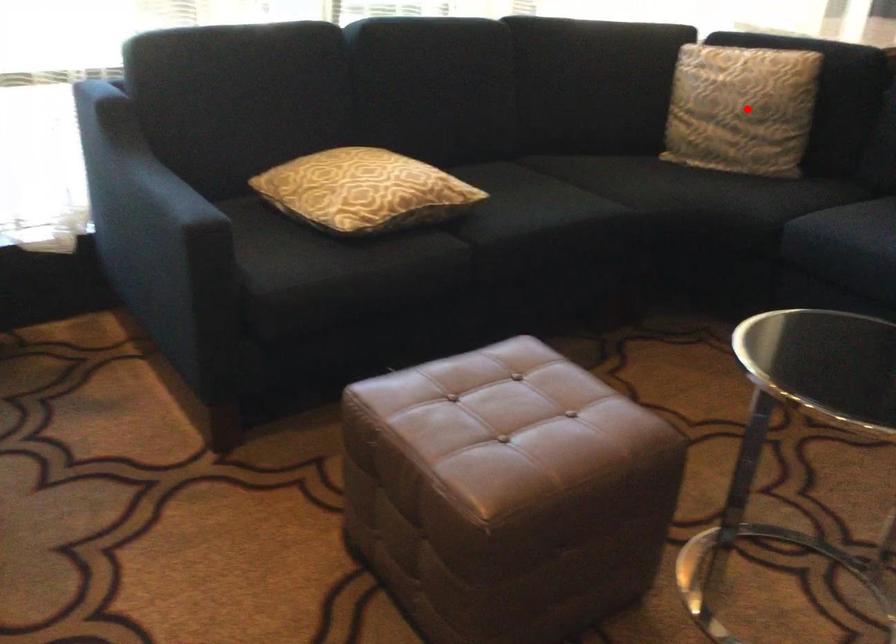
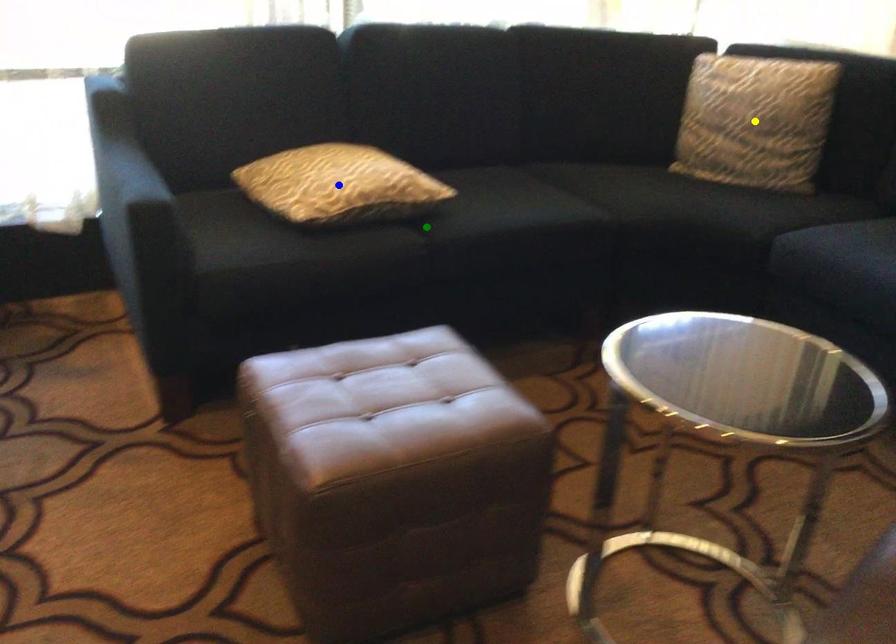
Question: I am providing you with two images of the same scene from different viewpoints. A red point is marked on the first image. You are given multiple points on the second image. Which spot in image 2 lines up with the point in image 1?

Choices:
 (A) blue point
 (B) yellow point
 (C) green point

Answer: (B)